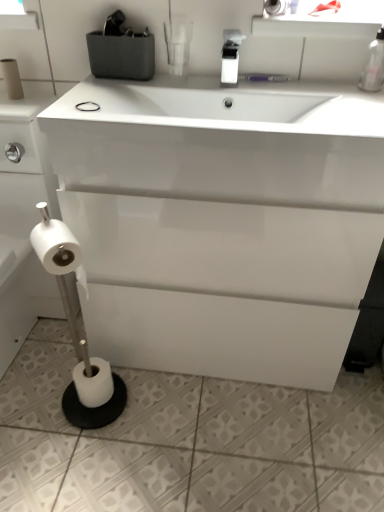
Image resolution: width=384 pixels, height=512 pixels. I want to click on free space that is to the left of white matte toilet paper at lower left, which ranks as the 4th toilet paper in top-to-bottom order, so click(x=42, y=398).